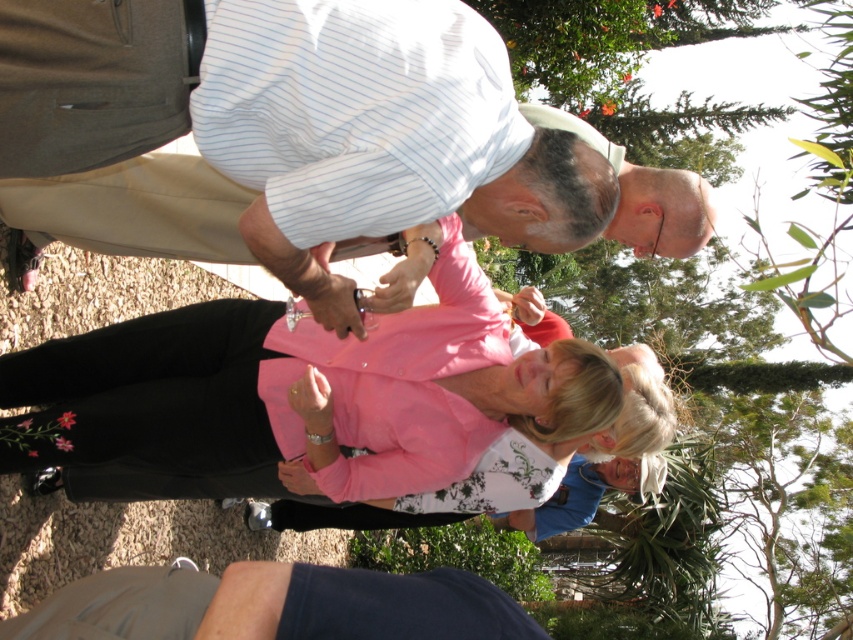
You are at a social gathering in a park and see a person wearing a pink jacket over a white shirt with floral patterns holding a glass. There is also a point marked at coordinates (x=334, y=128). What is the significance of this point?

The point at (x=334, y=128) indicates the location of the white striped shirt at upper center, which belongs to the person dressed in a striped shirt and beige pants standing close to the individual in the pink jacket.

You are standing at the point marked as point (x=334, y=128) in the image. Which object is exactly at your current location?

The white striped shirt at upper center is exactly at point (x=334, y=128).

You are a photographer trying to capture a candid shot of both the white striped shirt at upper center and the pink fabric blouse at center. Given that your camera has a maximum focus range of 1 meter, will you be able to include both subjects in the same frame without adjusting your position?

The distance between the white striped shirt at upper center and the pink fabric blouse at center is 86.86 centimeters, which is within the camera maximum focus range of 1 meter. Therefore, you can capture both subjects in the same frame without moving.